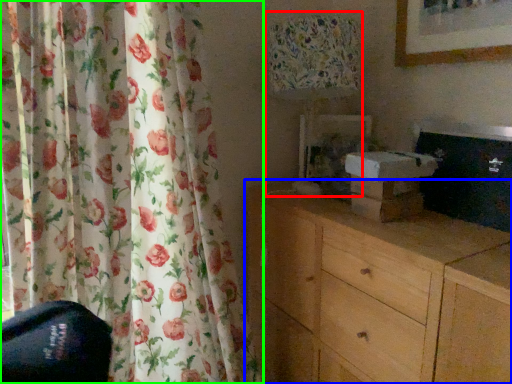
Question: Which is nearer to the table lamp (highlighted by a red box)? chest of drawers (highlighted by a blue box) or curtain (highlighted by a green box).

Choices:
 (A) chest of drawers
 (B) curtain

Answer: (A)